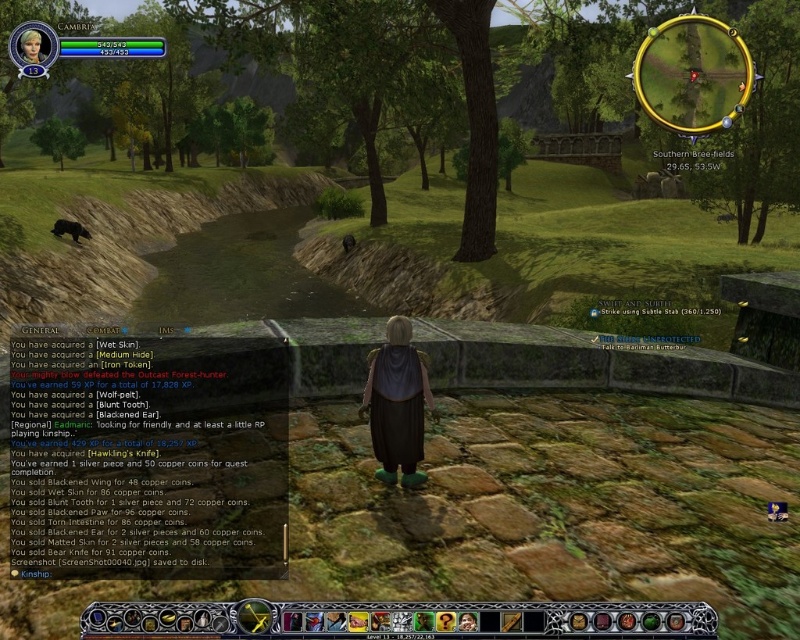
Which is more to the right, matte black cloak at center or blonde hair at upper left?

matte black cloak at center is more to the right.

Image resolution: width=800 pixels, height=640 pixels. What do you see at coordinates (397, 403) in the screenshot?
I see `matte black cloak at center` at bounding box center [397, 403].

Is point (394, 419) positioned behind point (46, 36)?

That is True.

Where is `matte black cloak at center`? This screenshot has height=640, width=800. matte black cloak at center is located at coordinates (397, 403).